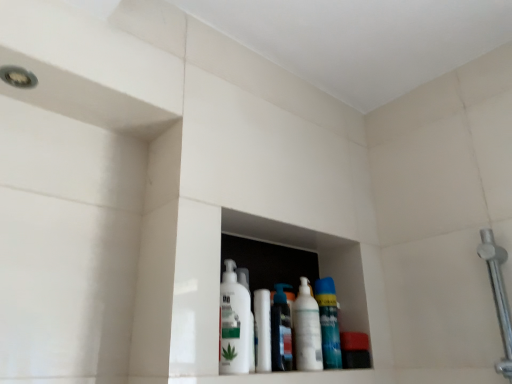
Question: Is white glossy lotion at center, marked as the first cleaning product in a left-to-right arrangement, thinner than blue glossy spray can at center, acting as the 4th cleaning product starting from the left?

Choices:
 (A) yes
 (B) no

Answer: (B)

Question: From a real-world perspective, does white glossy lotion at center, which appears as the 4th cleaning product when viewed from the right, sit lower than blue glossy spray can at center, acting as the 4th cleaning product starting from the left?

Choices:
 (A) yes
 (B) no

Answer: (B)

Question: Is blue glossy spray can at center, acting as the 4th cleaning product starting from the left, inside white glossy lotion at center, which appears as the 4th cleaning product when viewed from the right?

Choices:
 (A) yes
 (B) no

Answer: (B)

Question: From the image's perspective, is white glossy lotion at center, which appears as the 4th cleaning product when viewed from the right, below blue glossy spray can at center, positioned as the first cleaning product in right-to-left order?

Choices:
 (A) no
 (B) yes

Answer: (A)

Question: Does white glossy lotion at center, marked as the first cleaning product in a left-to-right arrangement, have a larger size compared to blue glossy spray can at center, positioned as the first cleaning product in right-to-left order?

Choices:
 (A) no
 (B) yes

Answer: (B)

Question: Does white glossy lotion at center, marked as the first cleaning product in a left-to-right arrangement, have a smaller size compared to blue glossy spray can at center, positioned as the first cleaning product in right-to-left order?

Choices:
 (A) no
 (B) yes

Answer: (A)

Question: From the image's perspective, is white glossy bottle at center, which is counted as the 2th cleaning product, starting from the right, under translucent plastic spray can at center, which is counted as the second cleaning product, starting from the left?

Choices:
 (A) yes
 (B) no

Answer: (B)

Question: Does white glossy bottle at center, which ranks as the third cleaning product in left-to-right order, come in front of translucent plastic spray can at center, arranged as the 3th cleaning product when viewed from the right?

Choices:
 (A) yes
 (B) no

Answer: (A)

Question: Is white glossy bottle at center, which ranks as the third cleaning product in left-to-right order, thinner than translucent plastic spray can at center, which is counted as the second cleaning product, starting from the left?

Choices:
 (A) no
 (B) yes

Answer: (A)

Question: Are white glossy bottle at center, which ranks as the third cleaning product in left-to-right order, and translucent plastic spray can at center, arranged as the 3th cleaning product when viewed from the right, far apart?

Choices:
 (A) yes
 (B) no

Answer: (B)

Question: From a real-world perspective, is white glossy bottle at center, which ranks as the third cleaning product in left-to-right order, positioned under translucent plastic spray can at center, which is counted as the second cleaning product, starting from the left, based on gravity?

Choices:
 (A) no
 (B) yes

Answer: (A)

Question: Is white glossy bottle at center, which is counted as the 2th cleaning product, starting from the right, bigger than translucent plastic spray can at center, which is counted as the second cleaning product, starting from the left?

Choices:
 (A) no
 (B) yes

Answer: (B)

Question: Are translucent plastic spray can at center, arranged as the 3th cleaning product when viewed from the right, and polished chrome shower arm at right located far from each other?

Choices:
 (A) no
 (B) yes

Answer: (A)